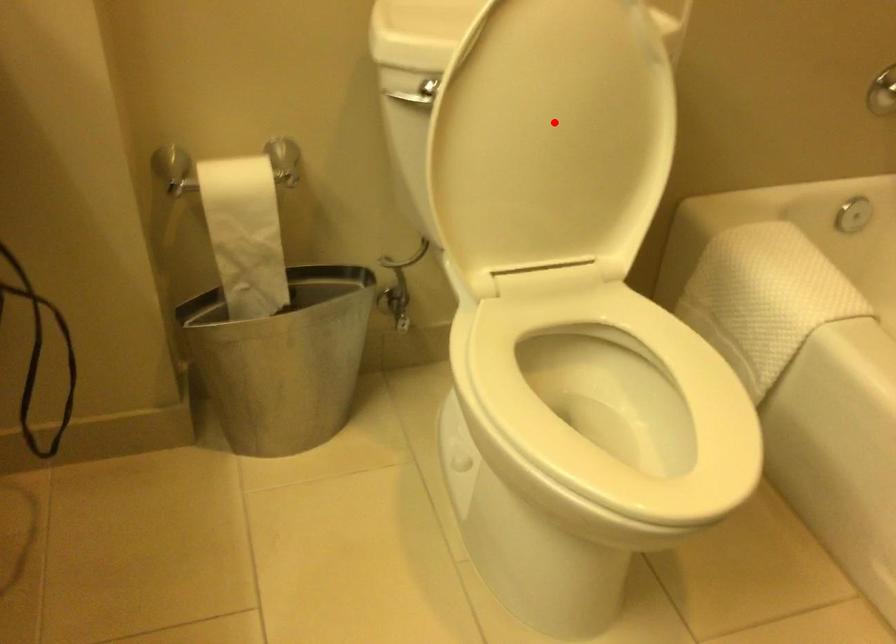
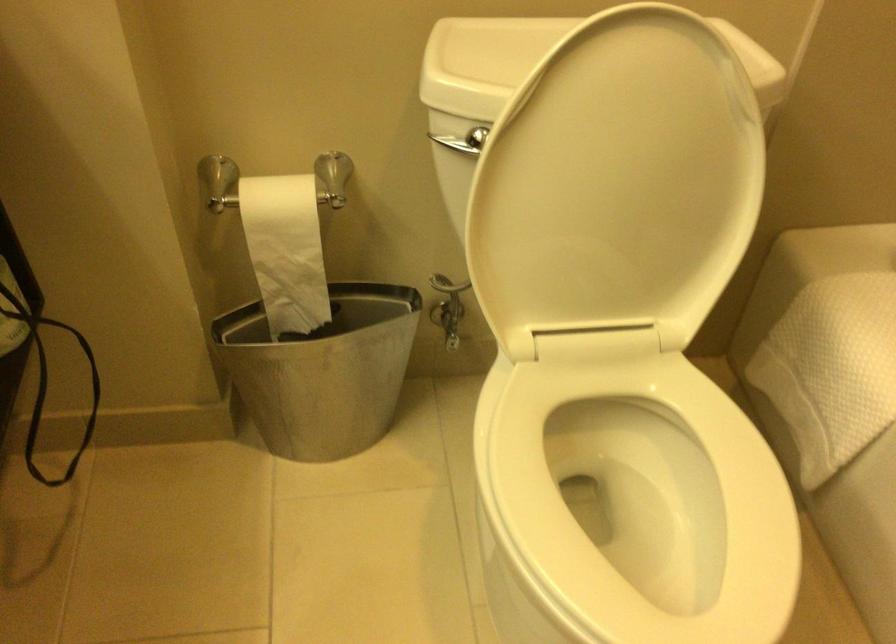
Locate, in the second image, the point that corresponds to the highlighted location in the first image.

(617, 183)